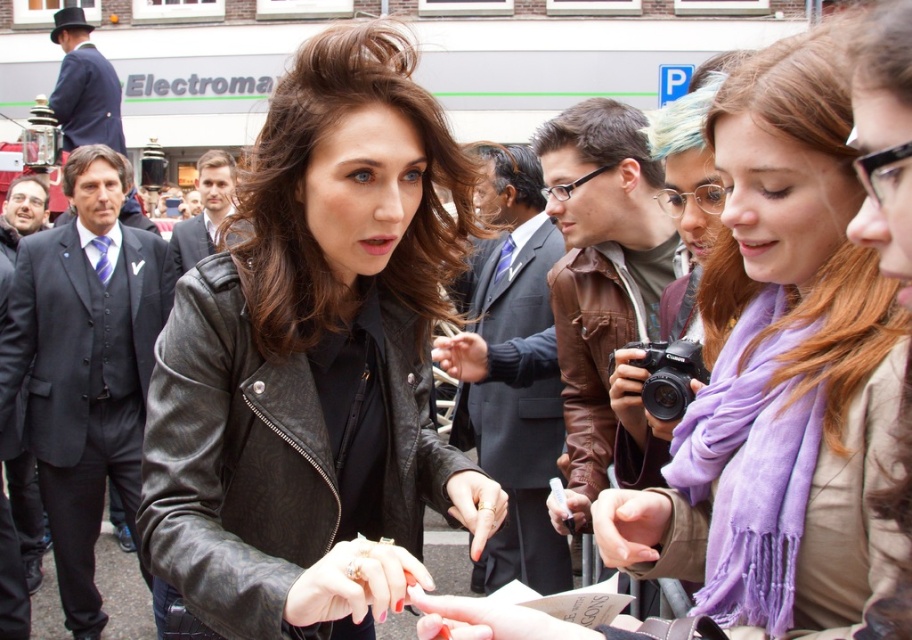
You are a photographer at the event and want to capture a photo that includes both the point at coordinate point (413, 460) and point (825, 566). Which point is closer to the camera so that you can focus on it first?

Point (413, 460) is closer to the camera than point (825, 566), so you should focus on point (413, 460) first.

You are a photographer at the event and want to capture a closeup of the woman signing the autograph. The point at coordinates point (313,362) is on the black leather jacket at center. Can you tell me which object this point is located on?

The point at coordinates point (313,362) is located on the black leather jacket at center.

In the scene shown: You are a photographer standing at the edge of the crowd. You want to take a photo of the woman signing autographs. The black leather jacket at center and the purple scarf at center are both in your viewfinder. Which object is closer to you?

The black leather jacket at center is 7.03 meters away from the purple scarf at center. Since both are at the center, they are equidistant from you, so neither is closer.